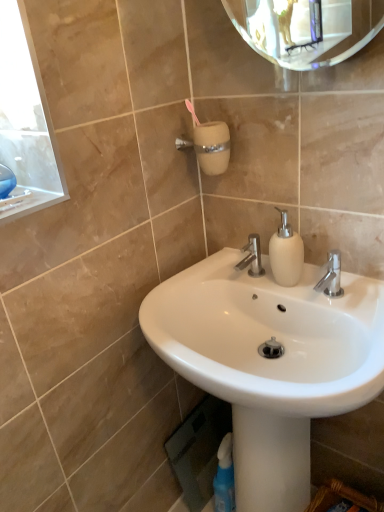
Question: Would you say white matte soap dispenser at center is to the left or to the right of white glossy sink at center in the picture?

Choices:
 (A) left
 (B) right

Answer: (B)

Question: From a real-world perspective, is white matte soap dispenser at center positioned above or below white glossy sink at center?

Choices:
 (A) above
 (B) below

Answer: (A)

Question: Estimate the real-world distances between objects in this image. Which object is farther from the polished chrome faucet at center?

Choices:
 (A) white glossy sink at center
 (B) white matte soap dispenser at center

Answer: (A)

Question: Estimate the real-world distances between objects in this image. Which object is closer to the polished chrome faucet at center?

Choices:
 (A) white matte soap dispenser at center
 (B) white glossy sink at center

Answer: (A)